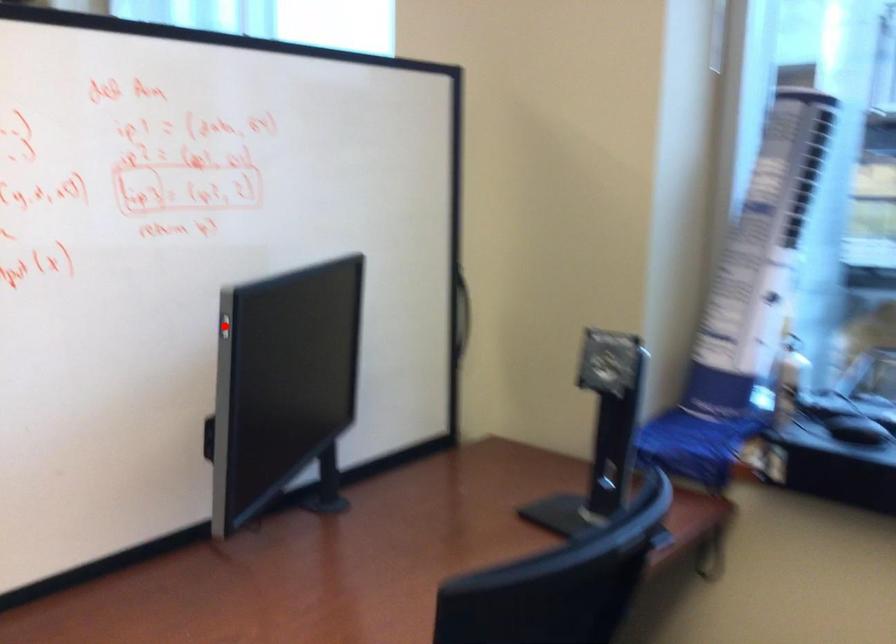
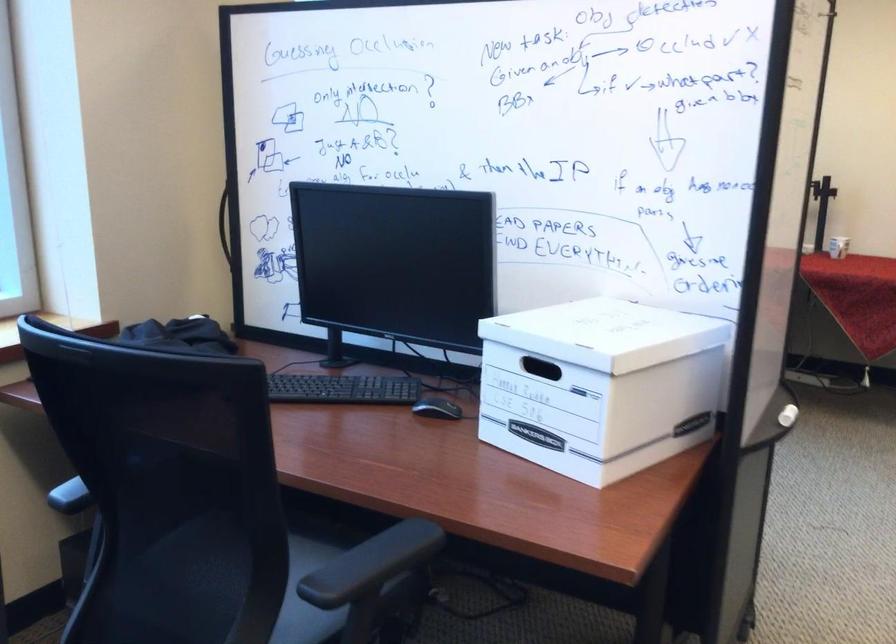
Question: I am providing you with two images of the same scene from different viewpoints. A red point is marked on the first image. At the location where the point appears in image 1, is it still visible in image 2?

Choices:
 (A) Yes
 (B) No

Answer: (B)